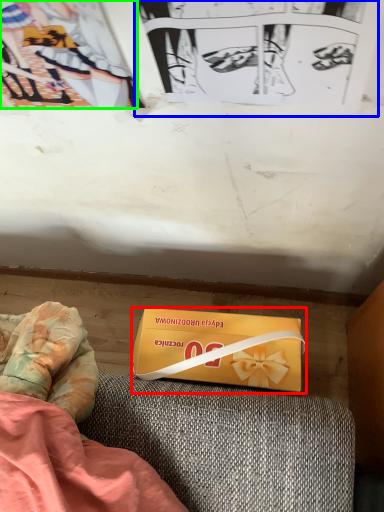
Question: Which object is positioned closest to box (highlighted by a red box)? Select from paperback book (highlighted by a blue box) and couple (highlighted by a green box).

Choices:
 (A) paperback book
 (B) couple

Answer: (A)